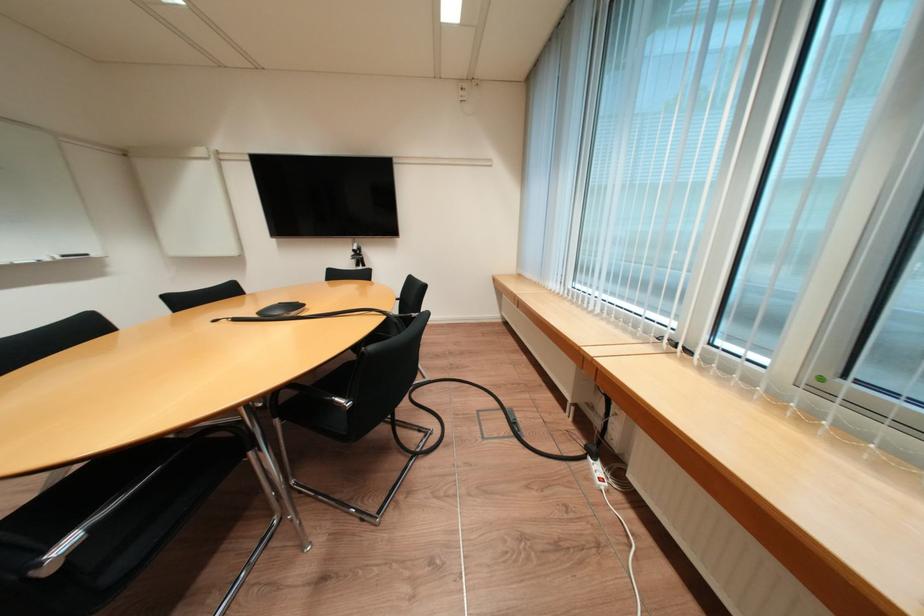
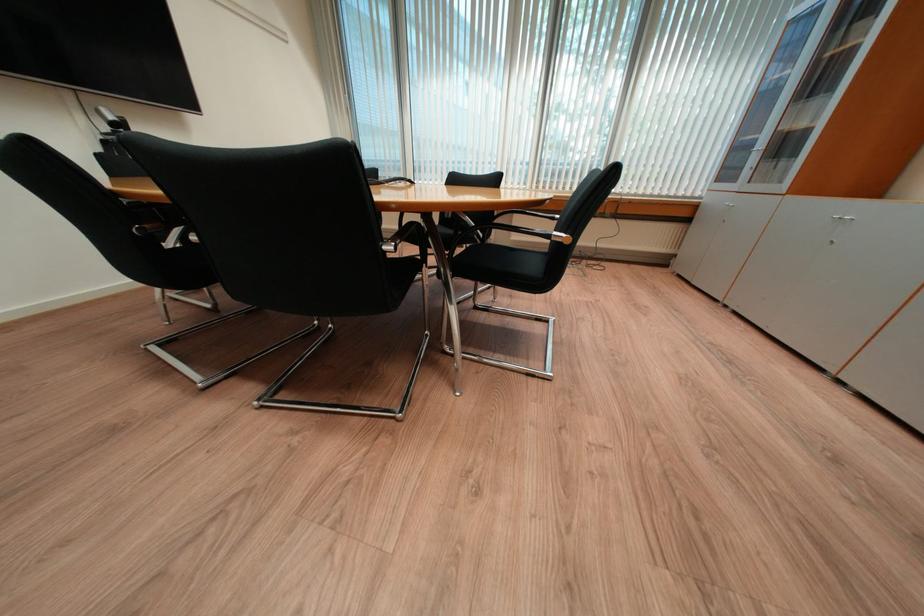
Question: I am providing you with two images of the same scene from different viewpoints. After the viewpoint changes to image2, which objects are now occluded?

Choices:
 (A) cabinet door handle
 (B) metal chair armrest
 (C) grey pet bed
 (D) black conference phone

Answer: (D)